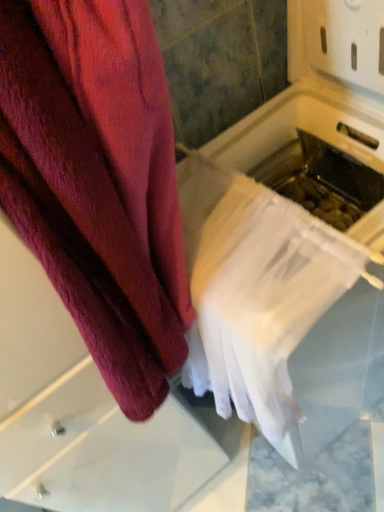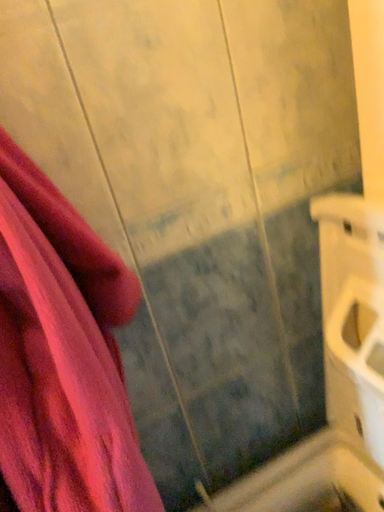
Question: Which way did the camera rotate in the video?

Choices:
 (A) rotated downward
 (B) rotated upward

Answer: (B)